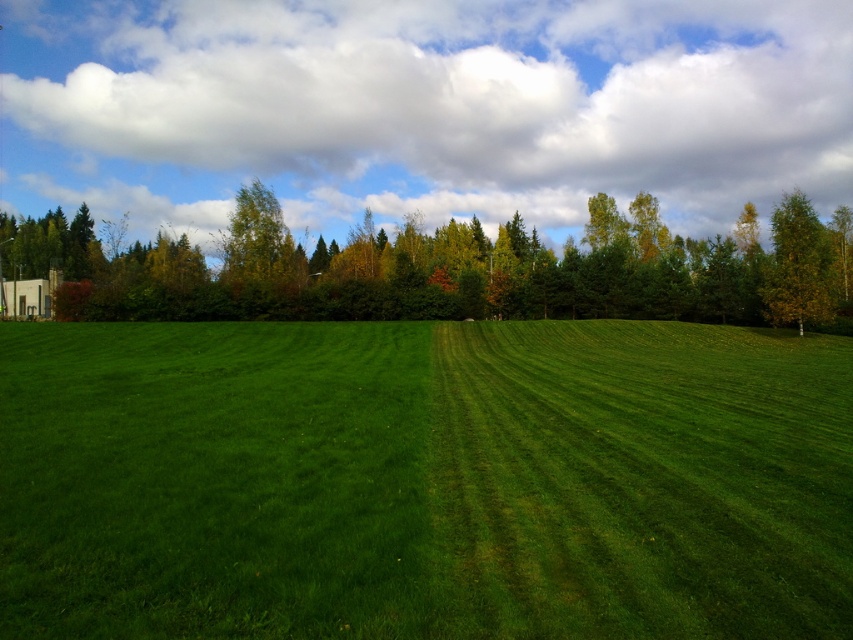
In the scene shown: Who is shorter, green grass at center or yellow-green leafy tree at right?

With less height is green grass at center.

Does green grass at center have a lesser height compared to yellow-green leafy tree at right?

Indeed, green grass at center has a lesser height compared to yellow-green leafy tree at right.

The image size is (853, 640). What do you see at coordinates (424, 481) in the screenshot?
I see `green grass at center` at bounding box center [424, 481].

Where is `green grass at center`? The image size is (853, 640). green grass at center is located at coordinates (424, 481).

Locate an element on the screen. green leafy tree at center is located at coordinates pyautogui.click(x=447, y=269).

Does green leafy tree at center appear on the left side of yellow-green leafy tree at right?

Correct, you'll find green leafy tree at center to the left of yellow-green leafy tree at right.

Who is more forward, (361, 312) or (807, 204)?

Positioned in front is point (807, 204).

Locate an element on the screen. Image resolution: width=853 pixels, height=640 pixels. green leafy tree at center is located at coordinates (447, 269).

Is green grass at center positioned behind green leafy tree at center?

No, it is not.

Does point (196, 360) lie in front of point (316, 312)?

That is True.

Where is `green grass at center`? green grass at center is located at coordinates (424, 481).